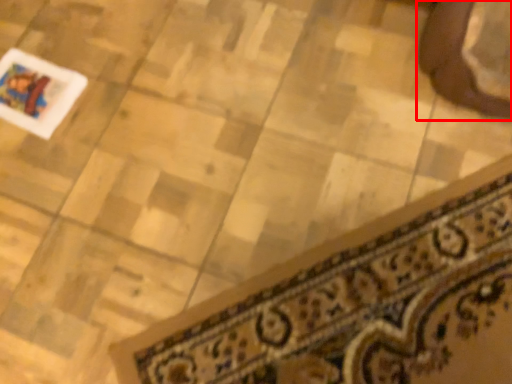
Question: In this image, where is footwear (annotated by the red box) located relative to doormat?

Choices:
 (A) right
 (B) left

Answer: (A)